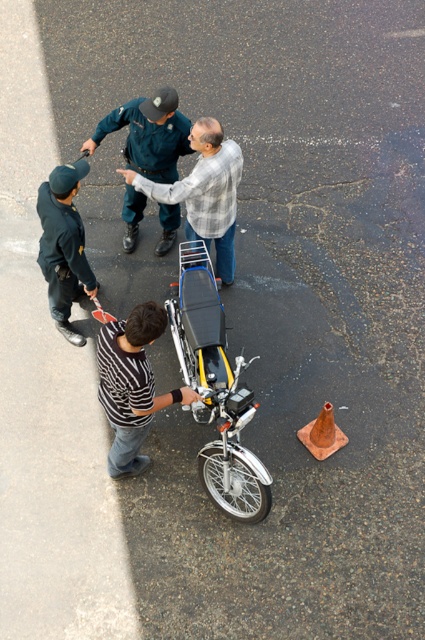
You are a pedestrian on the sidewalk and see the dark blue uniform at left and the orange matte traffic cone at lower right. Which object is closer to the sidewalk?

The dark blue uniform at left is closer to the sidewalk because it is positioned to the left of the orange matte traffic cone at lower right, which is further away.

In the scene shown: You are a delivery person who needs to move a 1.8 meter long package from the black matte motorcycle at center to the dark blue uniform at upper center. Can you place the package between them without moving either the motorcycle or the uniform?

The distance between the black matte motorcycle at center and the dark blue uniform at upper center is 1.66 meters. Since the package is 1.8 meters long, it cannot fit between them without overlapping either the motorcycle or the uniform.